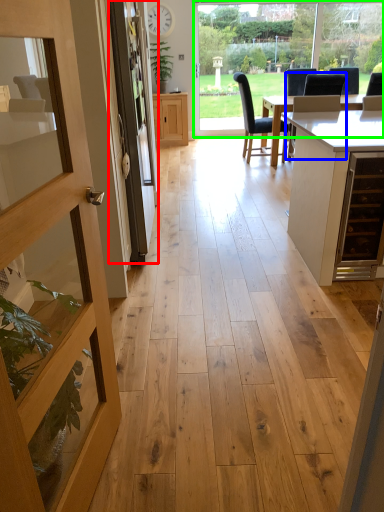
Question: Which object is the farthest from screen door (highlighted by a red box)? Choose among these: chair (highlighted by a blue box) or window frame (highlighted by a green box).

Choices:
 (A) chair
 (B) window frame

Answer: (B)